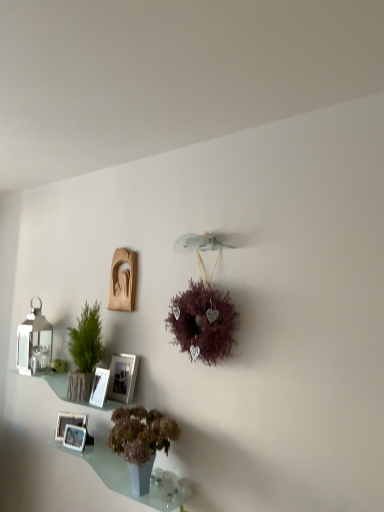
Question: Would you say white glossy picture frame at lower left, arranged as the 3th picture frame when ordered from the bottom, is to the left or to the right of matte silver picture frame at center, the fourth picture frame ordered from the bottom, in the picture?

Choices:
 (A) left
 (B) right

Answer: (A)

Question: From a real-world perspective, is white glossy picture frame at lower left, arranged as the 3th picture frame when ordered from the bottom, above or below matte silver picture frame at center, the fourth picture frame ordered from the bottom?

Choices:
 (A) below
 (B) above

Answer: (A)

Question: Which object is the farthest from the translucent glass shelf at lower center, which appears as the 2th window sill when viewed from the top?

Choices:
 (A) matte beige statue at upper center, placed as the 5th picture frame when sorted from bottom to top
 (B) matte silver picture frame at center, the 2th picture frame from the top
 (C) purple matte wreath at center
 (D) satin silver lantern at left
 (E) matte glass shelf at lower left, the 1th window sill from the top

Answer: (A)

Question: Which of these objects is positioned farthest from the white glossy picture frame at lower left, arranged as the 3th picture frame when ordered from the bottom?

Choices:
 (A) white glossy picture frame at lower left, placed as the 1th picture frame when sorted from bottom to top
 (B) matte beige statue at upper center, marked as the first picture frame in a top-to-bottom arrangement
 (C) translucent glass shelf at lower center, which appears as the 2th window sill when viewed from the top
 (D) green textured vase at left, positioned as the first houseplant in top-to-bottom order
 (E) satin silver lantern at left

Answer: (E)